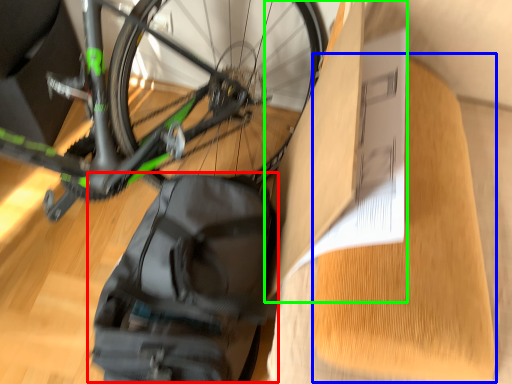
Question: Based on their relative distances, which object is farther from backpack (highlighted by a red box)? Choose from cardboard (highlighted by a blue box) and cardboard box (highlighted by a green box).

Choices:
 (A) cardboard
 (B) cardboard box

Answer: (A)